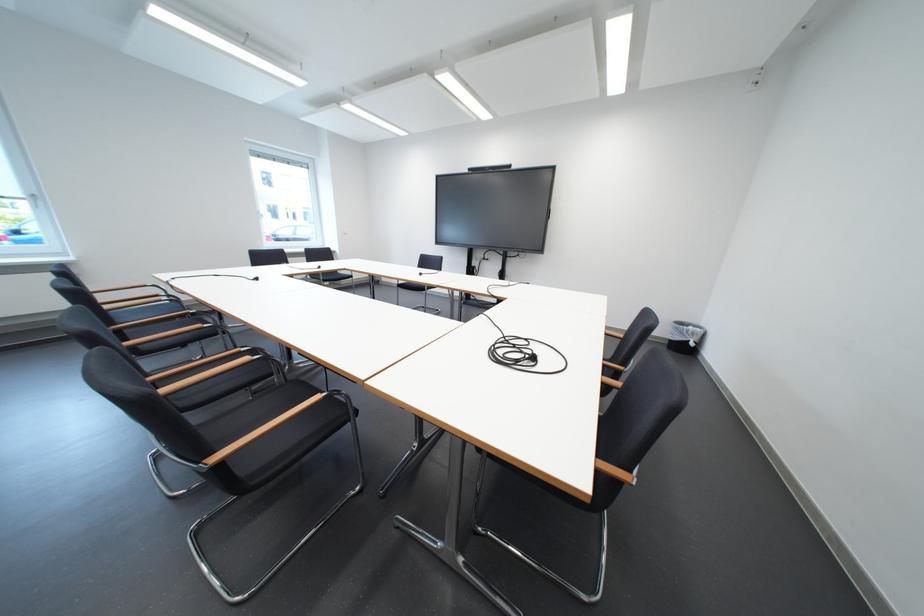
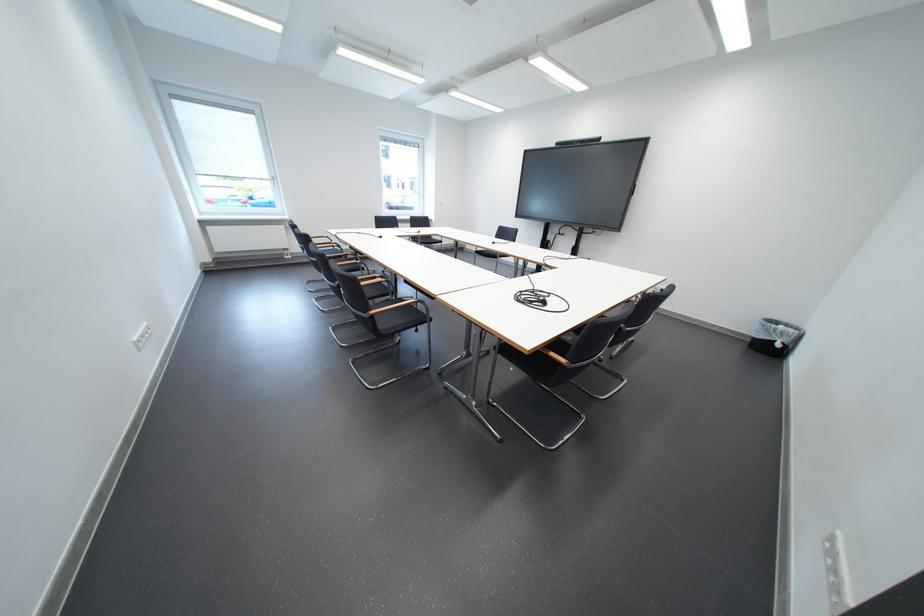
The point at [506,346] is marked in the first image. Where is the corresponding point in the second image?

(533, 294)